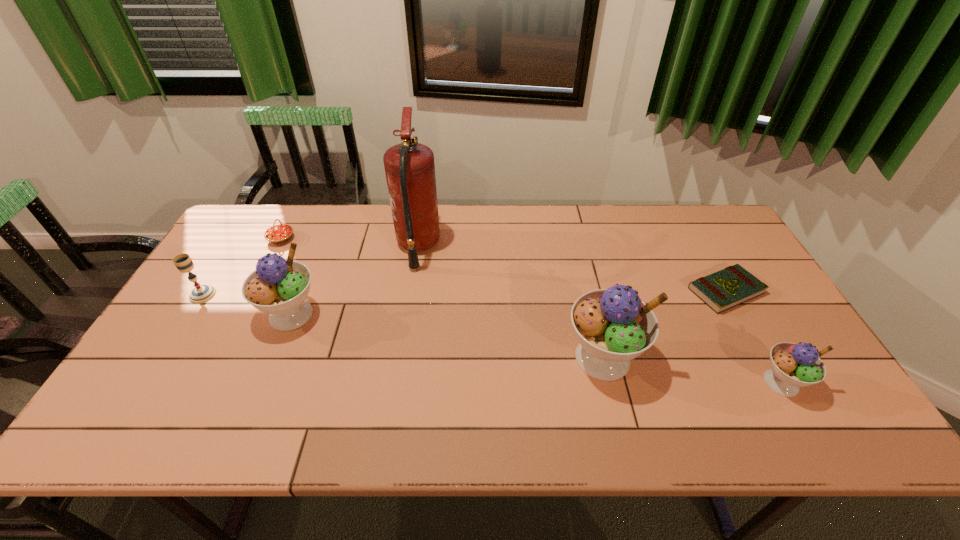
The image size is (960, 540). I want to click on the second shortest icecream, so click(x=278, y=287).

The height and width of the screenshot is (540, 960). I want to click on the leftmost icecream, so click(x=278, y=287).

This screenshot has height=540, width=960. Identify the location of the second icecream from right to left. (613, 326).

At what (x,y) coordinates should I click in order to perform the action: click on the shortest icecream. Please return your answer as a coordinate pair (x, y). Image resolution: width=960 pixels, height=540 pixels. Looking at the image, I should click on (793, 365).

At what (x,y) coordinates should I click in order to perform the action: click on strawberry. Please return your answer as a coordinate pair (x, y). Looking at the image, I should click on (277, 234).

I want to click on the sixth tallest object, so click(277, 234).

What are the coordinates of `the tallest object` in the screenshot? It's located at (409, 167).

At what (x,y) coordinates should I click in order to perform the action: click on fire extinguisher. Please return your answer as a coordinate pair (x, y). This screenshot has height=540, width=960. Looking at the image, I should click on [x=409, y=167].

Where is `the shortest object`? The width and height of the screenshot is (960, 540). the shortest object is located at coordinates (734, 285).

Where is `the leftmost object`? The width and height of the screenshot is (960, 540). the leftmost object is located at coordinates (202, 293).